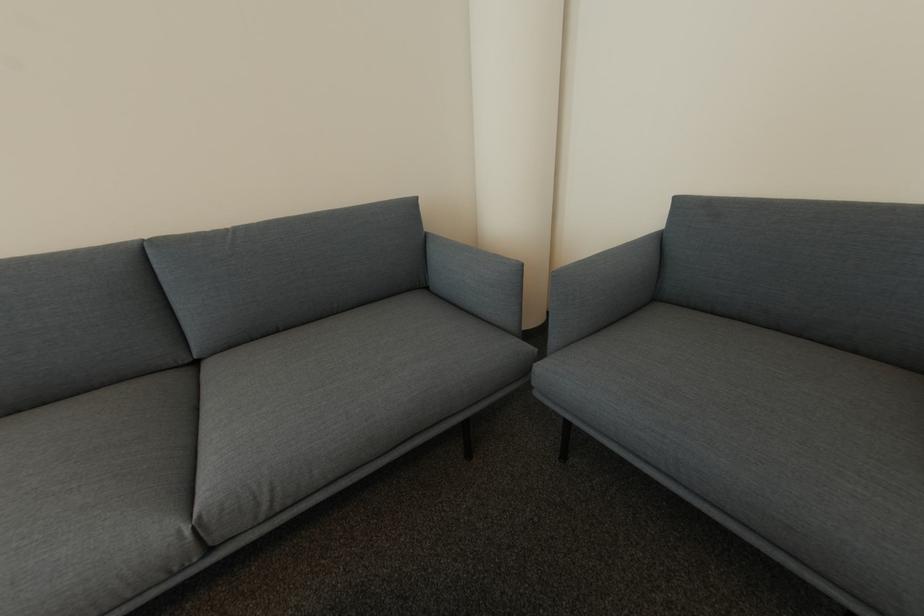
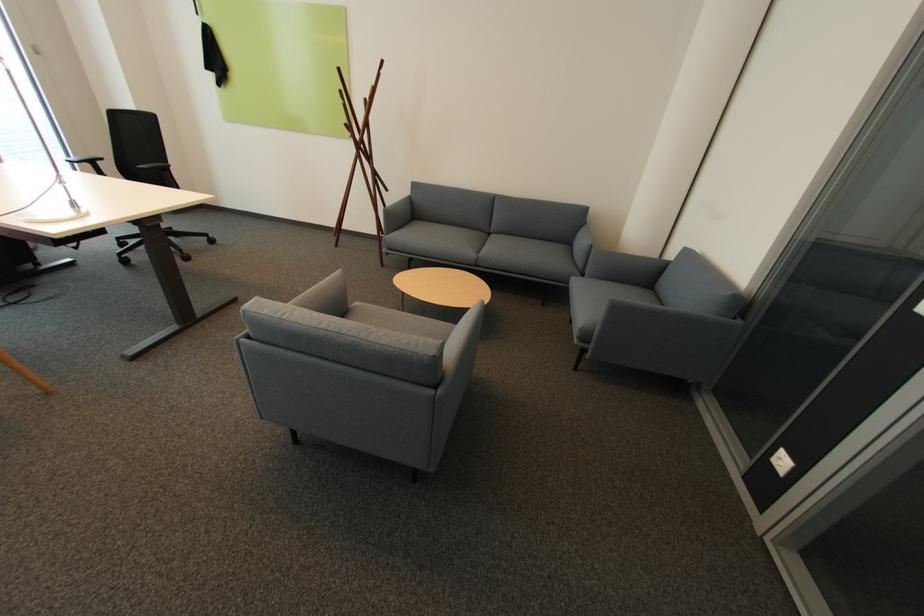
Find the pixel in the second image that matches the point at 216,552 in the first image.

(482, 265)